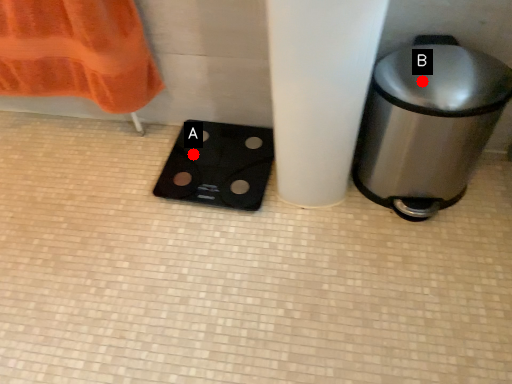
Question: Two points are circled on the image, labeled by A and B beside each circle. Which point is farther to the camera?

Choices:
 (A) A is further
 (B) B is further

Answer: (A)